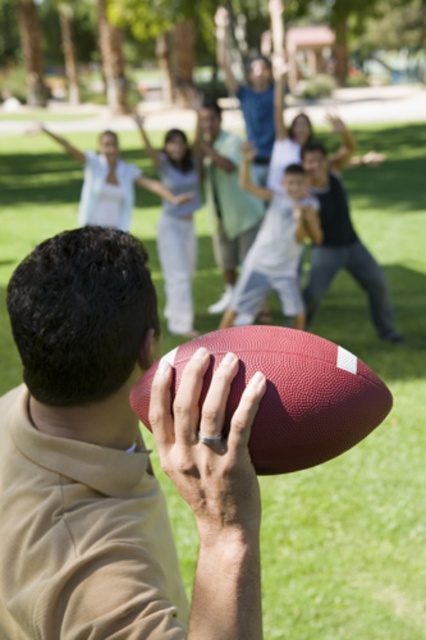
Can you confirm if matte black shirt at center is positioned below light blue cotton shirt at upper center?

Yes, matte black shirt at center is below light blue cotton shirt at upper center.

Does matte black shirt at center have a smaller size compared to light blue cotton shirt at upper center?

No.

The width and height of the screenshot is (426, 640). What do you see at coordinates (340, 246) in the screenshot?
I see `matte black shirt at center` at bounding box center [340, 246].

The image size is (426, 640). In order to click on matte black shirt at center in this screenshot , I will do `click(340, 246)`.

In the scene shown: Is leather textured football at center wider than light blue cotton shirt at upper center?

No, leather textured football at center is not wider than light blue cotton shirt at upper center.

Who is taller, leather textured football at center or light blue cotton shirt at upper center?

With more height is light blue cotton shirt at upper center.

This screenshot has width=426, height=640. Identify the location of leather textured football at center. (293, 394).

Does brown leather football at center have a greater height compared to leather textured football at center?

Indeed, brown leather football at center has a greater height compared to leather textured football at center.

You are a GUI agent. You are given a task and a screenshot of the screen. Output one action in this format:
    pyautogui.click(x=<x>, y=<y>)
    Task: Click on the brown leather football at center
    This screenshot has width=426, height=640.
    Given the screenshot: What is the action you would take?
    pyautogui.click(x=118, y=460)